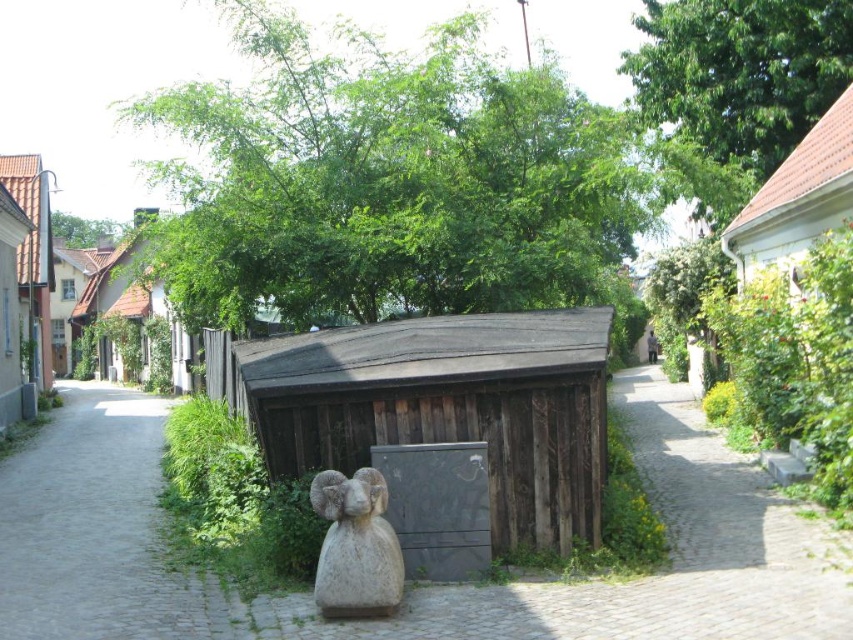
Does brown wooden hut at upper right appear on the right side of white stone ram at center?

Indeed, brown wooden hut at upper right is positioned on the right side of white stone ram at center.

Which is below, brown wooden hut at upper right or white stone ram at center?

white stone ram at center is lower down.

Which is in front, point (791, 196) or point (384, 563)?

Positioned in front is point (384, 563).

Where is `brown wooden hut at upper right`? The width and height of the screenshot is (853, 640). brown wooden hut at upper right is located at coordinates (798, 198).

Can you confirm if green leafy tree at center is taller than brown wooden hut at upper center?

Yes.

Does green leafy tree at center come behind brown wooden hut at upper center?

No.

This screenshot has height=640, width=853. What do you see at coordinates (392, 180) in the screenshot? I see `green leafy tree at center` at bounding box center [392, 180].

Locate an element on the screen. green leafy tree at center is located at coordinates (392, 180).

Is wooden hut at upper left further to camera compared to green leafy tree at upper center?

No.

Which of these two, wooden hut at upper left or green leafy tree at upper center, stands shorter?

green leafy tree at upper center is shorter.

Does point (71, 316) come behind point (91, 228)?

No, (71, 316) is closer to viewer.

Locate an element on the screen. wooden hut at upper left is located at coordinates (70, 294).